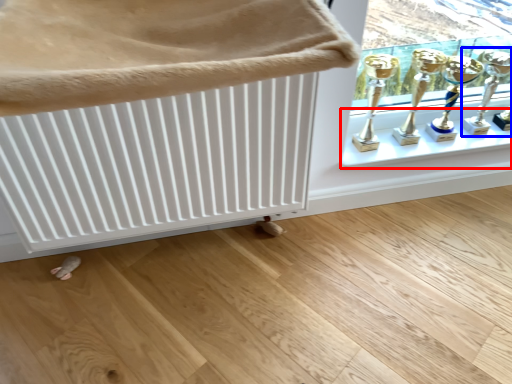
Question: Which of the following is the closest to the observer, window sill (highlighted by a red box) or candle holder (highlighted by a blue box)?

Choices:
 (A) window sill
 (B) candle holder

Answer: (B)